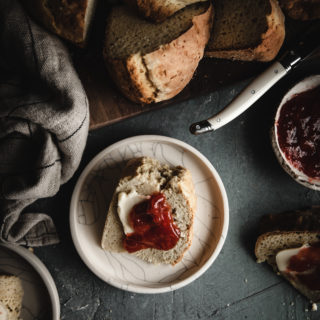
This screenshot has width=320, height=320. I want to click on bowl, so click(278, 158).